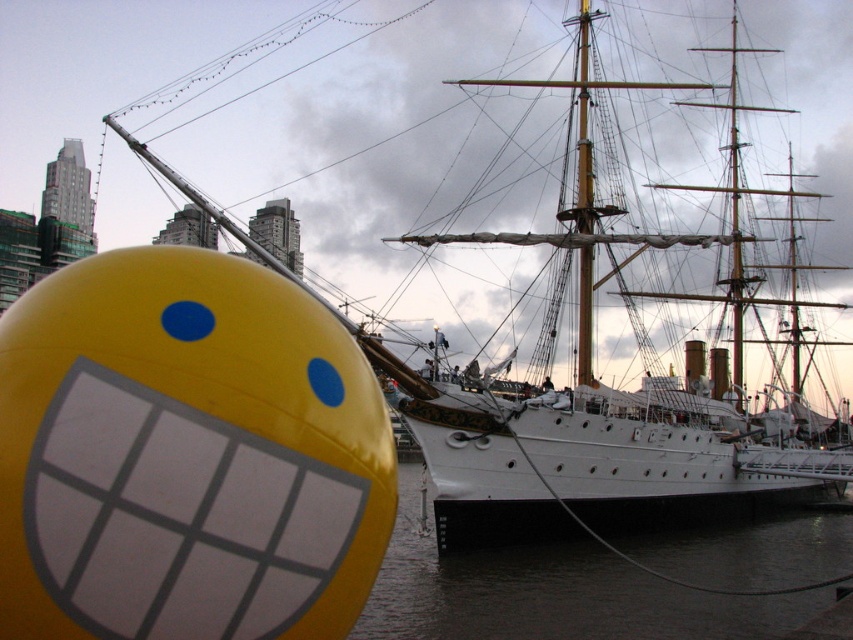
Can you confirm if yellow matte bobfloat at lower left is thinner than dark water at lower center?

Correct, yellow matte bobfloat at lower left's width is less than dark water at lower center's.

Is yellow matte bobfloat at lower left closer to camera compared to dark water at lower center?

Yes, yellow matte bobfloat at lower left is closer to the viewer.

Between point (227, 371) and point (589, 609), which one is positioned in front?

Point (227, 371) is more forward.

Find the location of a particular element. yellow matte bobfloat at lower left is located at coordinates (184, 456).